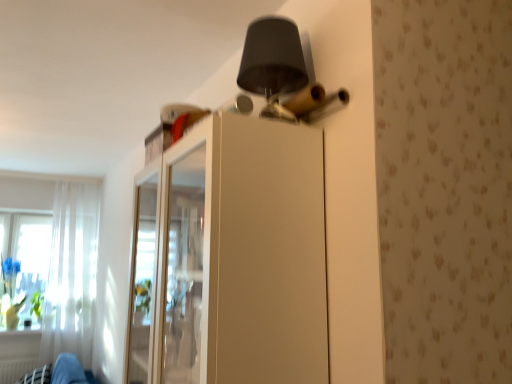
Question: In the image, is white glossy cabinet at upper center on the left side or the right side of white sheer curtain at left?

Choices:
 (A) right
 (B) left

Answer: (A)

Question: In terms of size, does white glossy cabinet at upper center appear bigger or smaller than white sheer curtain at left?

Choices:
 (A) big
 (B) small

Answer: (A)

Question: Which is nearer to the white glossy cabinet at upper center?

Choices:
 (A) black fabric swivel chair at lower left
 (B) white sheer curtain at left

Answer: (A)

Question: Which object is the closest to the white sheer curtain at left?

Choices:
 (A) white glossy cabinet at upper center
 (B) black fabric swivel chair at lower left

Answer: (B)